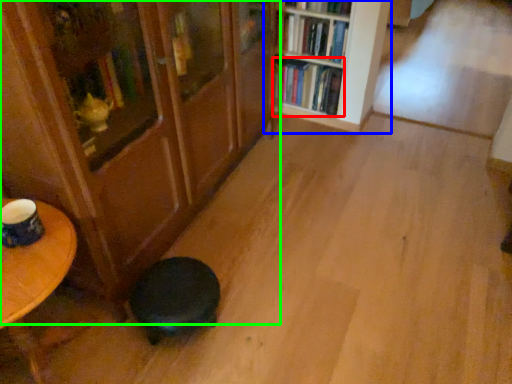
Question: Considering the real-world distances, which object is closest to book (highlighted by a red box)? bookcase (highlighted by a blue box) or bookcase (highlighted by a green box).

Choices:
 (A) bookcase
 (B) bookcase

Answer: (A)